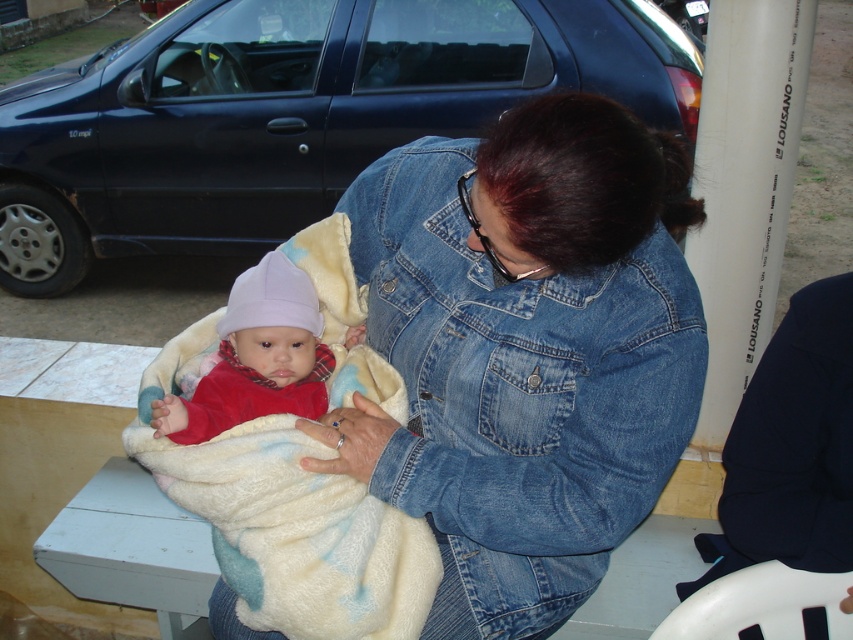
Between fluffy white blanket at center and matte red sweater at center, which one is positioned lower?

Positioned lower is fluffy white blanket at center.

Can you confirm if fluffy white blanket at center is positioned to the right of matte red sweater at center?

Indeed, fluffy white blanket at center is positioned on the right side of matte red sweater at center.

Where is `fluffy white blanket at center`? fluffy white blanket at center is located at coordinates (287, 451).

Can you confirm if denim jacket at center is bigger than fluffy white blanket at center?

Indeed, denim jacket at center has a larger size compared to fluffy white blanket at center.

Which is behind, point (479, 476) or point (305, 577)?

Positioned behind is point (479, 476).

Describe the element at coordinates (520, 390) in the screenshot. I see `denim jacket at center` at that location.

Locate an element on the screen. denim jacket at center is located at coordinates (520, 390).

Can you confirm if denim jacket at center is positioned to the left of matte red sweater at center?

Incorrect, denim jacket at center is not on the left side of matte red sweater at center.

How much distance is there between denim jacket at center and matte red sweater at center?

The distance of denim jacket at center from matte red sweater at center is 9.79 inches.

Does point (426, 422) come behind point (213, 397)?

Yes, it is behind point (213, 397).

You are a GUI agent. You are given a task and a screenshot of the screen. Output one action in this format:
    pyautogui.click(x=<x>, y=<y>)
    Task: Click on the denim jacket at center
    This screenshot has height=640, width=853.
    Given the screenshot: What is the action you would take?
    pyautogui.click(x=520, y=390)